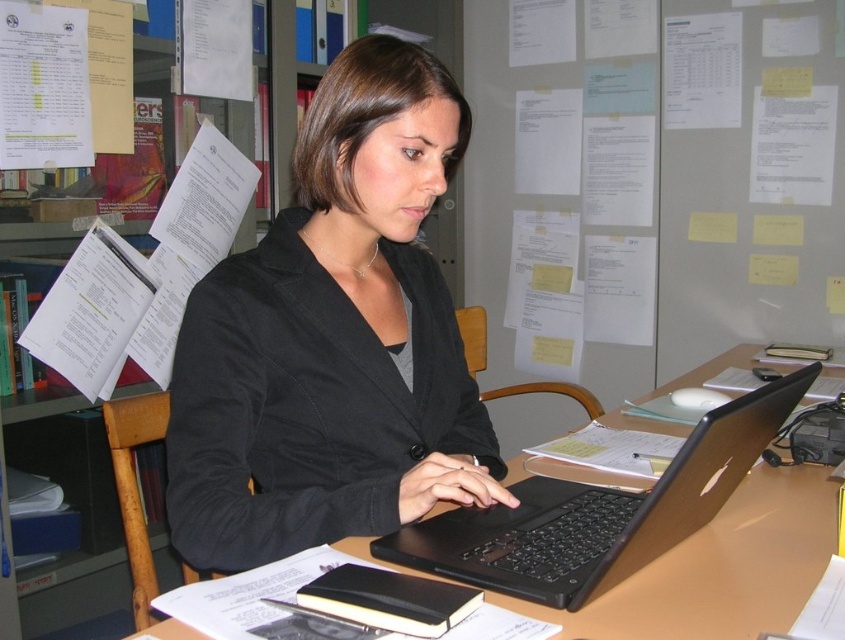
Question: Can you confirm if black matte blazer at center is positioned to the left of black plastic laptop at center?

Choices:
 (A) yes
 (B) no

Answer: (A)

Question: Can you confirm if black matte blazer at center is smaller than black plastic laptop at center?

Choices:
 (A) no
 (B) yes

Answer: (A)

Question: Is the position of black matte blazer at center less distant than that of black plastic laptop at center?

Choices:
 (A) yes
 (B) no

Answer: (B)

Question: Which point is closer to the camera?

Choices:
 (A) black plastic laptop at center
 (B) black matte blazer at center

Answer: (A)